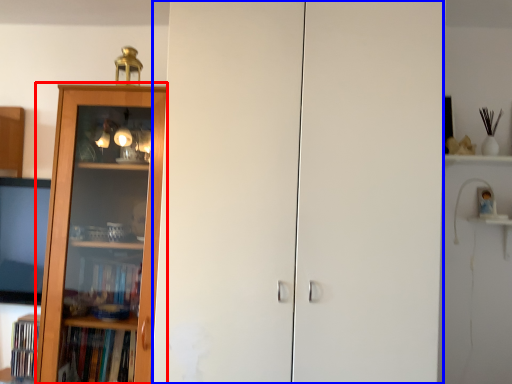
Question: Which object is closer to the camera taking this photo, bookcase (highlighted by a red box) or screen door (highlighted by a blue box)?

Choices:
 (A) bookcase
 (B) screen door

Answer: (B)